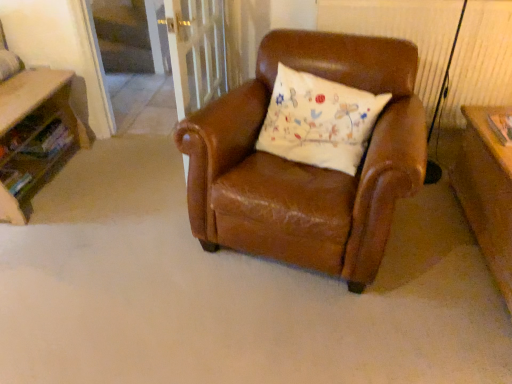
Question: From a real-world perspective, is white embroidered pillow at center located higher than clear glass screen door at upper center?

Choices:
 (A) yes
 (B) no

Answer: (A)

Question: Is white embroidered pillow at center closer to camera compared to clear glass screen door at upper center?

Choices:
 (A) yes
 (B) no

Answer: (A)

Question: Is white embroidered pillow at center at the left side of clear glass screen door at upper center?

Choices:
 (A) no
 (B) yes

Answer: (A)

Question: Can you confirm if white embroidered pillow at center is taller than clear glass screen door at upper center?

Choices:
 (A) no
 (B) yes

Answer: (A)

Question: Is white embroidered pillow at center facing away from clear glass screen door at upper center?

Choices:
 (A) no
 (B) yes

Answer: (A)

Question: Considering the relative sizes of white embroidered pillow at center and clear glass screen door at upper center in the image provided, is white embroidered pillow at center shorter than clear glass screen door at upper center?

Choices:
 (A) no
 (B) yes

Answer: (B)

Question: From a real-world perspective, is wooden table at left on top of white embroidered pillow at center?

Choices:
 (A) no
 (B) yes

Answer: (A)

Question: Is the position of wooden table at left less distant than that of white embroidered pillow at center?

Choices:
 (A) yes
 (B) no

Answer: (B)

Question: Can you confirm if wooden table at left is shorter than white embroidered pillow at center?

Choices:
 (A) yes
 (B) no

Answer: (A)

Question: From a real-world perspective, is wooden table at left below white embroidered pillow at center?

Choices:
 (A) no
 (B) yes

Answer: (B)

Question: Does wooden table at left appear on the left side of white embroidered pillow at center?

Choices:
 (A) no
 (B) yes

Answer: (B)

Question: From the image's perspective, is wooden table at left over white embroidered pillow at center?

Choices:
 (A) no
 (B) yes

Answer: (A)

Question: Considering the relative sizes of clear glass screen door at upper center and white embroidered pillow at center in the image provided, is clear glass screen door at upper center thinner than white embroidered pillow at center?

Choices:
 (A) yes
 (B) no

Answer: (A)